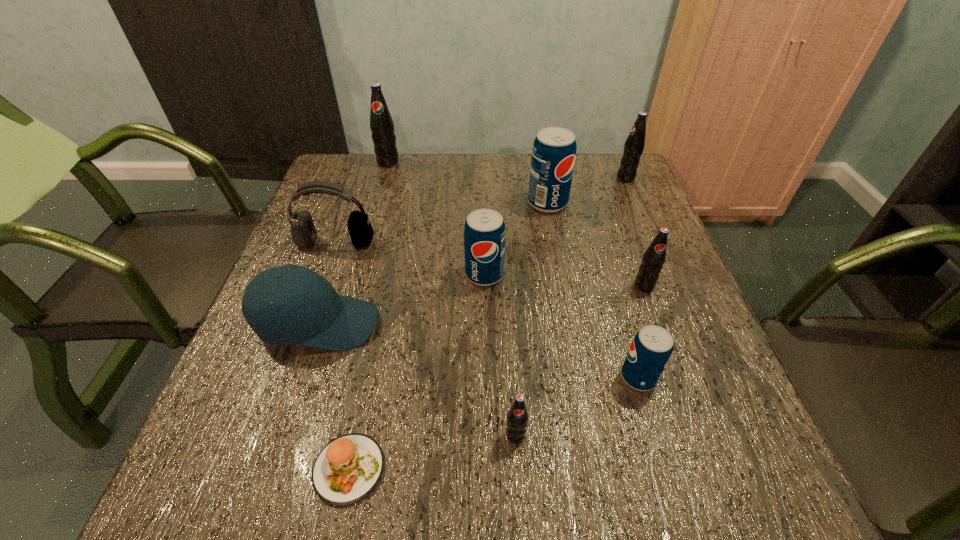
In the image, there is a desktop. What are the coordinates of `blank space at the far left corner` in the screenshot? It's located at (371, 172).

Where is `vacant space at the near left corner of the desktop`? The image size is (960, 540). vacant space at the near left corner of the desktop is located at coordinates (228, 456).

Identify the location of free space at the far right corner of the desktop. (611, 164).

The image size is (960, 540). I want to click on free space between the second nearest black pop and the leftmost blue pop, so click(564, 280).

The image size is (960, 540). What are the coordinates of `empty location between the rightmost black pop and the patty` in the screenshot? It's located at (488, 323).

I want to click on vacant area that lies between the shortest object and the headset, so click(343, 356).

Identify the location of free area in between the smallest blue pop and the fourth object from right to left. The image size is (960, 540). (593, 290).

Identify the location of vacant area that lies between the fourth farthest object and the third pop from right to left. This screenshot has height=540, width=960. (487, 310).

Image resolution: width=960 pixels, height=540 pixels. Identify the location of free space between the farthest pop and the black headset. (362, 202).

The image size is (960, 540). What are the coordinates of `vacant point located between the seventh object from left to right and the nearest pop` in the screenshot? It's located at (532, 319).